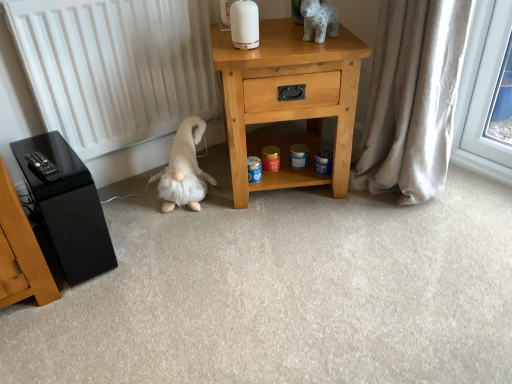
Question: Is fluffy white plush at lower left, positioned as the second animal in front-to-back order, oriented towards beige fabric curtain at right?

Choices:
 (A) yes
 (B) no

Answer: (B)

Question: Is beige fabric curtain at right inside fluffy white plush at lower left, which ranks as the 1th animal in bottom-to-top order?

Choices:
 (A) no
 (B) yes

Answer: (A)

Question: Is fluffy white plush at lower left, arranged as the 1th animal when viewed from the left, further to the viewer compared to beige fabric curtain at right?

Choices:
 (A) no
 (B) yes

Answer: (B)

Question: Is the depth of fluffy white plush at lower left, placed as the second animal when sorted from right to left, less than that of beige fabric curtain at right?

Choices:
 (A) no
 (B) yes

Answer: (A)

Question: From the image's perspective, would you say fluffy white plush at lower left, which ranks as the 1th animal in bottom-to-top order, is shown under beige fabric curtain at right?

Choices:
 (A) no
 (B) yes

Answer: (B)

Question: Are fluffy white plush at lower left, positioned as the second animal in front-to-back order, and beige fabric curtain at right far apart?

Choices:
 (A) no
 (B) yes

Answer: (A)

Question: Is light wood nightstand at center behind beige fabric curtain at right?

Choices:
 (A) yes
 (B) no

Answer: (A)

Question: Can you confirm if light wood nightstand at center is taller than beige fabric curtain at right?

Choices:
 (A) yes
 (B) no

Answer: (B)

Question: Is light wood nightstand at center in contact with beige fabric curtain at right?

Choices:
 (A) yes
 (B) no

Answer: (B)

Question: From a real-world perspective, is light wood nightstand at center under beige fabric curtain at right?

Choices:
 (A) yes
 (B) no

Answer: (A)

Question: Considering the relative sizes of light wood nightstand at center and beige fabric curtain at right in the image provided, is light wood nightstand at center bigger than beige fabric curtain at right?

Choices:
 (A) no
 (B) yes

Answer: (B)

Question: Considering the relative sizes of light wood nightstand at center and beige fabric curtain at right in the image provided, is light wood nightstand at center thinner than beige fabric curtain at right?

Choices:
 (A) no
 (B) yes

Answer: (A)

Question: From the image's perspective, is beige fabric curtain at right located beneath light wood nightstand at center?

Choices:
 (A) no
 (B) yes

Answer: (B)